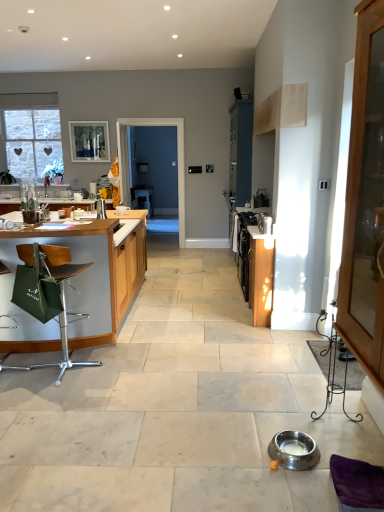
Locate an element on the screen. This screenshot has width=384, height=512. vacant area that is in front of green leather chair at left is located at coordinates (50, 398).